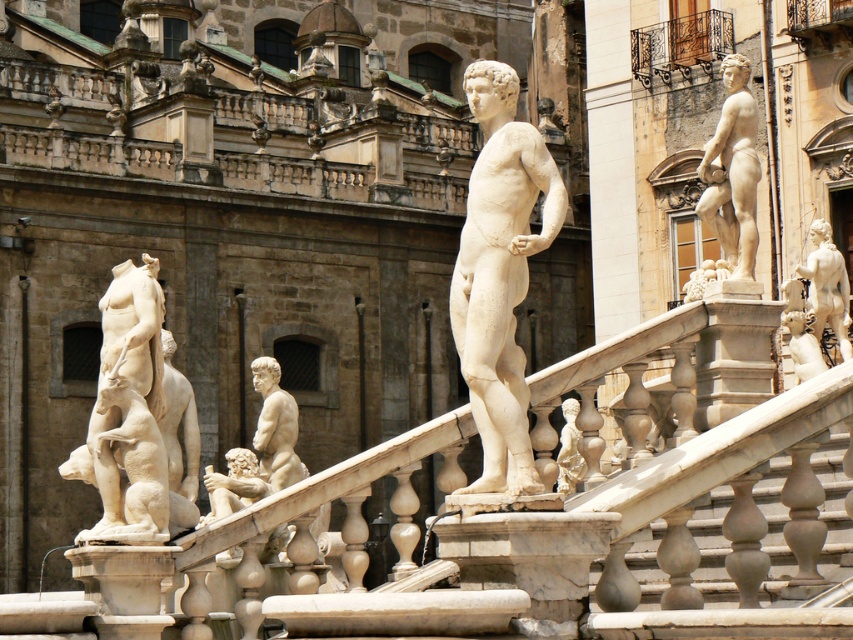
Question: Is white marble statue at right behind translucent glass figure at center?

Choices:
 (A) yes
 (B) no

Answer: (A)

Question: Which of these objects is positioned closest to the white marble statue at left?

Choices:
 (A) translucent glass figure at center
 (B) smooth beige statue at center
 (C) white marble statue at right
 (D) white marble statue at center

Answer: (B)

Question: Considering the real-world distances, which object is closest to the smooth beige statue at center?

Choices:
 (A) white marble stairs at center
 (B) white marble statue at center
 (C) white marble statue at upper right
 (D) white marble statue at lower right

Answer: (C)

Question: Which of the following is the closest to the observer?

Choices:
 (A) white marble statue at right
 (B) smooth beige statue at center

Answer: (B)

Question: Is white marble statue at left to the right of white marble statue at lower right from the viewer's perspective?

Choices:
 (A) yes
 (B) no

Answer: (B)

Question: From the image, what is the correct spatial relationship of white marble statue at upper right in relation to white marble statue at lower right?

Choices:
 (A) left
 (B) right

Answer: (A)